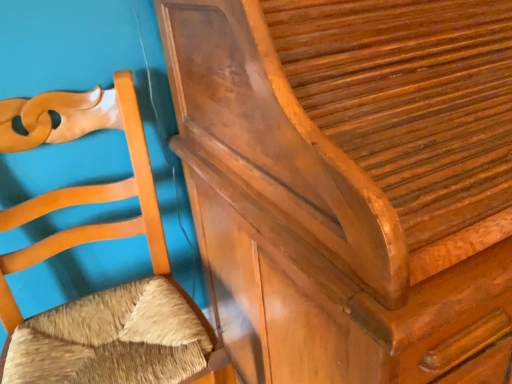
Describe the element at coordinates (350, 184) in the screenshot. The height and width of the screenshot is (384, 512). I see `shiny brown wood dresser at upper right, which is counted as the 1th furniture, starting from the right` at that location.

Image resolution: width=512 pixels, height=384 pixels. I want to click on shiny brown wood dresser at upper right, which is the 2th furniture in left-to-right order, so click(x=350, y=184).

What do you see at coordinates (95, 241) in the screenshot? I see `matte wood chair at left, placed as the first furniture when sorted from left to right` at bounding box center [95, 241].

At what (x,y) coordinates should I click in order to perform the action: click on matte wood chair at left, the 2th furniture positioned from the right. Please return your answer as a coordinate pair (x, y). Looking at the image, I should click on (95, 241).

In order to click on shiny brown wood dresser at upper right, which is the 2th furniture in left-to-right order in this screenshot , I will do `click(350, 184)`.

Between shiny brown wood dresser at upper right, which is counted as the 1th furniture, starting from the right, and matte wood chair at left, the 2th furniture positioned from the right, which one appears on the left side from the viewer's perspective?

matte wood chair at left, the 2th furniture positioned from the right, is more to the left.

Which object is further away from the camera, shiny brown wood dresser at upper right, which is counted as the 1th furniture, starting from the right, or matte wood chair at left, the 2th furniture positioned from the right?

matte wood chair at left, the 2th furniture positioned from the right, is more distant.

Which is farther from the camera, (478, 177) or (135, 294)?

Point (135, 294)

Consider the image. From the image's perspective, is shiny brown wood dresser at upper right, which is counted as the 1th furniture, starting from the right, above or below matte wood chair at left, the 2th furniture positioned from the right?

Clearly, from the image's perspective, shiny brown wood dresser at upper right, which is counted as the 1th furniture, starting from the right, is above matte wood chair at left, the 2th furniture positioned from the right.

From a real-world perspective, between shiny brown wood dresser at upper right, which is counted as the 1th furniture, starting from the right, and matte wood chair at left, placed as the first furniture when sorted from left to right, who is vertically higher?

In real-world perspective, shiny brown wood dresser at upper right, which is counted as the 1th furniture, starting from the right, is above.

Which object is thinner, shiny brown wood dresser at upper right, which is counted as the 1th furniture, starting from the right, or matte wood chair at left, placed as the first furniture when sorted from left to right?

With smaller width is matte wood chair at left, placed as the first furniture when sorted from left to right.

Is shiny brown wood dresser at upper right, which is counted as the 1th furniture, starting from the right, shorter than matte wood chair at left, placed as the first furniture when sorted from left to right?

Incorrect, the height of shiny brown wood dresser at upper right, which is counted as the 1th furniture, starting from the right, does not fall short of that of matte wood chair at left, placed as the first furniture when sorted from left to right.

Can you confirm if shiny brown wood dresser at upper right, which is the 2th furniture in left-to-right order, is smaller than matte wood chair at left, the 2th furniture positioned from the right?

Actually, shiny brown wood dresser at upper right, which is the 2th furniture in left-to-right order, might be larger than matte wood chair at left, the 2th furniture positioned from the right.

Is matte wood chair at left, placed as the first furniture when sorted from left to right, completely or partially inside shiny brown wood dresser at upper right, which is counted as the 1th furniture, starting from the right?

That's incorrect, matte wood chair at left, placed as the first furniture when sorted from left to right, is not inside shiny brown wood dresser at upper right, which is counted as the 1th furniture, starting from the right.

Is shiny brown wood dresser at upper right, which is counted as the 1th furniture, starting from the right, beside matte wood chair at left, the 2th furniture positioned from the right?

They are not placed beside each other.

Is shiny brown wood dresser at upper right, which is counted as the 1th furniture, starting from the right, facing towards matte wood chair at left, placed as the first furniture when sorted from left to right?

No, shiny brown wood dresser at upper right, which is counted as the 1th furniture, starting from the right, is not aimed at matte wood chair at left, placed as the first furniture when sorted from left to right.

Can you tell me how much shiny brown wood dresser at upper right, which is the 2th furniture in left-to-right order, and matte wood chair at left, placed as the first furniture when sorted from left to right, differ in facing direction?

The angular difference between shiny brown wood dresser at upper right, which is the 2th furniture in left-to-right order, and matte wood chair at left, placed as the first furniture when sorted from left to right, is 2.11 degrees.

Measure the distance from shiny brown wood dresser at upper right, which is the 2th furniture in left-to-right order, to matte wood chair at left, the 2th furniture positioned from the right.

shiny brown wood dresser at upper right, which is the 2th furniture in left-to-right order, and matte wood chair at left, the 2th furniture positioned from the right, are 14.50 inches apart.

Locate an element on the screen. The image size is (512, 384). furniture directly beneath the shiny brown wood dresser at upper right, which is the 2th furniture in left-to-right order (from a real-world perspective) is located at coordinates (95, 241).

Can you confirm if matte wood chair at left, the 2th furniture positioned from the right, is positioned to the left of shiny brown wood dresser at upper right, which is the 2th furniture in left-to-right order?

Correct, you'll find matte wood chair at left, the 2th furniture positioned from the right, to the left of shiny brown wood dresser at upper right, which is the 2th furniture in left-to-right order.

Is matte wood chair at left, placed as the first furniture when sorted from left to right, further to camera compared to shiny brown wood dresser at upper right, which is counted as the 1th furniture, starting from the right?

Yes, matte wood chair at left, placed as the first furniture when sorted from left to right, is further from the viewer.

Is point (36, 378) behind point (206, 279)?

No, (36, 378) is closer to viewer.

From the image's perspective, which is below, matte wood chair at left, the 2th furniture positioned from the right, or shiny brown wood dresser at upper right, which is counted as the 1th furniture, starting from the right?

matte wood chair at left, the 2th furniture positioned from the right, is shown below in the image.

From a real-world perspective, is matte wood chair at left, placed as the first furniture when sorted from left to right, physically above shiny brown wood dresser at upper right, which is counted as the 1th furniture, starting from the right?

No.

Based on the photo, between matte wood chair at left, placed as the first furniture when sorted from left to right, and shiny brown wood dresser at upper right, which is the 2th furniture in left-to-right order, which one has larger width?

With larger width is shiny brown wood dresser at upper right, which is the 2th furniture in left-to-right order.

In the scene shown: Considering the sizes of matte wood chair at left, the 2th furniture positioned from the right, and shiny brown wood dresser at upper right, which is the 2th furniture in left-to-right order, in the image, is matte wood chair at left, the 2th furniture positioned from the right, taller or shorter than shiny brown wood dresser at upper right, which is the 2th furniture in left-to-right order,?

Considering their sizes, matte wood chair at left, the 2th furniture positioned from the right, has less height than shiny brown wood dresser at upper right, which is the 2th furniture in left-to-right order.

Can you confirm if matte wood chair at left, the 2th furniture positioned from the right, is smaller than shiny brown wood dresser at upper right, which is counted as the 1th furniture, starting from the right?

Yes.

Would you say matte wood chair at left, the 2th furniture positioned from the right, is inside or outside shiny brown wood dresser at upper right, which is the 2th furniture in left-to-right order?

matte wood chair at left, the 2th furniture positioned from the right, is spatially situated outside shiny brown wood dresser at upper right, which is the 2th furniture in left-to-right order.

Is matte wood chair at left, the 2th furniture positioned from the right, next to shiny brown wood dresser at upper right, which is the 2th furniture in left-to-right order?

No, matte wood chair at left, the 2th furniture positioned from the right, is not beside shiny brown wood dresser at upper right, which is the 2th furniture in left-to-right order.

Is matte wood chair at left, the 2th furniture positioned from the right, looking in the opposite direction of shiny brown wood dresser at upper right, which is the 2th furniture in left-to-right order?

matte wood chair at left, the 2th furniture positioned from the right, is not turned away from shiny brown wood dresser at upper right, which is the 2th furniture in left-to-right order.

How many degrees apart are the facing directions of matte wood chair at left, placed as the first furniture when sorted from left to right, and shiny brown wood dresser at upper right, which is the 2th furniture in left-to-right order?

The angular difference between matte wood chair at left, placed as the first furniture when sorted from left to right, and shiny brown wood dresser at upper right, which is the 2th furniture in left-to-right order, is 2.11 degrees.

At what (x,y) coordinates should I click in order to perform the action: click on furniture that is under the shiny brown wood dresser at upper right, which is counted as the 1th furniture, starting from the right (from a real-world perspective). Please return your answer as a coordinate pair (x, y). The width and height of the screenshot is (512, 384). Looking at the image, I should click on (95, 241).

This screenshot has width=512, height=384. Find the location of `furniture on the left of the shiny brown wood dresser at upper right, which is the 2th furniture in left-to-right order`. furniture on the left of the shiny brown wood dresser at upper right, which is the 2th furniture in left-to-right order is located at coordinates (95, 241).

Where is `furniture that is above the matte wood chair at left, the 2th furniture positioned from the right (from the image's perspective)`? This screenshot has height=384, width=512. furniture that is above the matte wood chair at left, the 2th furniture positioned from the right (from the image's perspective) is located at coordinates (350, 184).